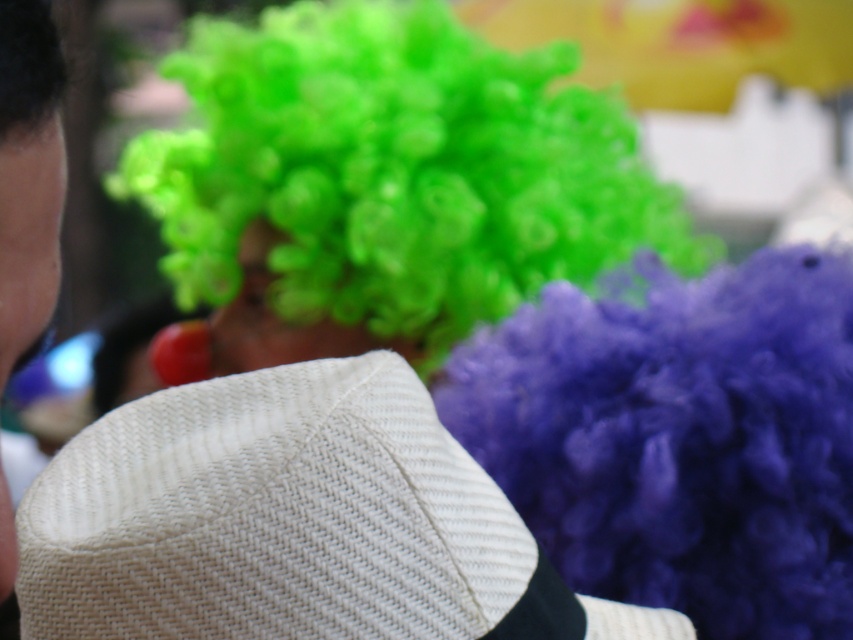
Question: Which object appears closest to the camera in this image?

Choices:
 (A) white woven straw hat at center
 (B) white woven hat at left

Answer: (B)

Question: Is white woven straw hat at center to the left of white woven hat at left from the viewer's perspective?

Choices:
 (A) no
 (B) yes

Answer: (A)

Question: Is white woven straw hat at center bigger than white woven hat at left?

Choices:
 (A) no
 (B) yes

Answer: (B)

Question: Is white woven straw hat at center wider than white woven hat at left?

Choices:
 (A) no
 (B) yes

Answer: (B)

Question: Among these objects, which one is nearest to the camera?

Choices:
 (A) white woven hat at left
 (B) white woven straw hat at center

Answer: (A)

Question: Among these objects, which one is farthest from the camera?

Choices:
 (A) white woven straw hat at center
 (B) white woven hat at left

Answer: (A)